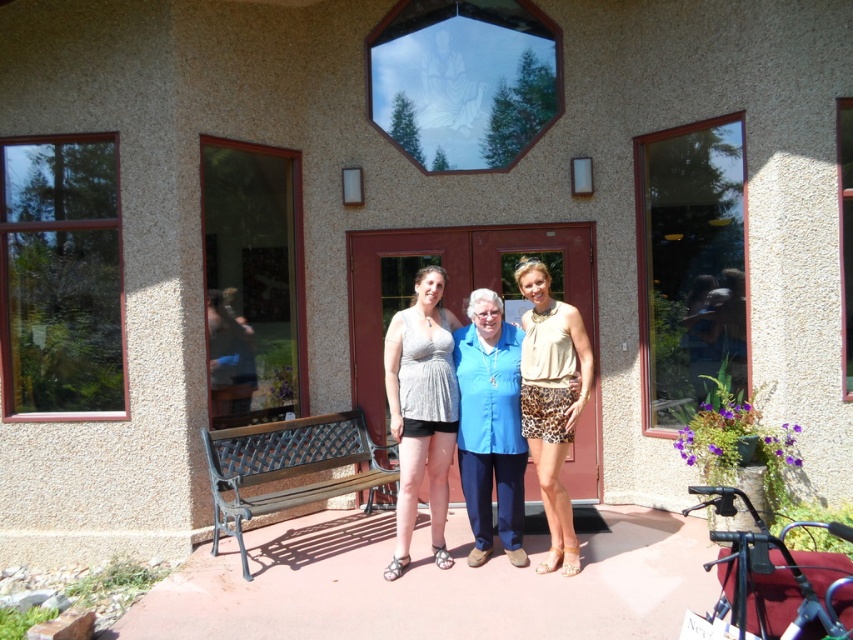
You are a fashion designer observing the group of three people in front of the beige stucco building. You notice the shiny silver tank top at center and the leopard print shorts at center. Which clothing item is positioned lower on the person wearing them?

The shiny silver tank top at center is located below leopard print shorts at center, so the shiny silver tank top at center is positioned lower on the person wearing them.

You are a photographer positioned at the camera. You want to capture a closeup shot of the shiny silver tank top at center. Given that your camera can focus on objects within 2 meters, will you be able to take the photo without moving closer?

The shiny silver tank top at center is 4.37 meters away from the camera. Since the camera can only focus on objects within 2 meters, you will need to move closer to take the closeup shot.